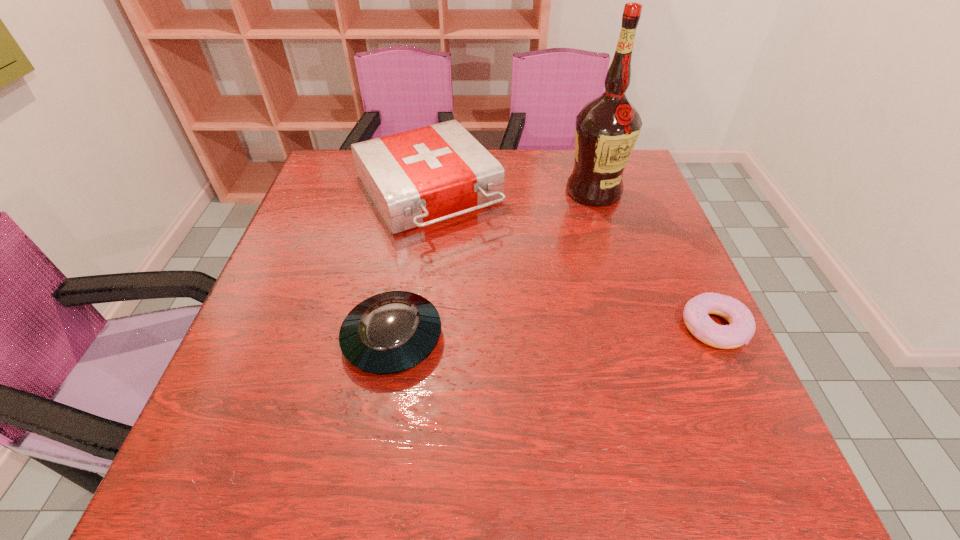
Identify the location of vacant spot on the desktop that is between the second shortest object and the shortest object and is positioned on the label of the tallest object. (577, 332).

The width and height of the screenshot is (960, 540). I want to click on free space on the desktop that is between the saucer and the shortest object and is positioned on the front side of the first-aid kit, so click(x=531, y=334).